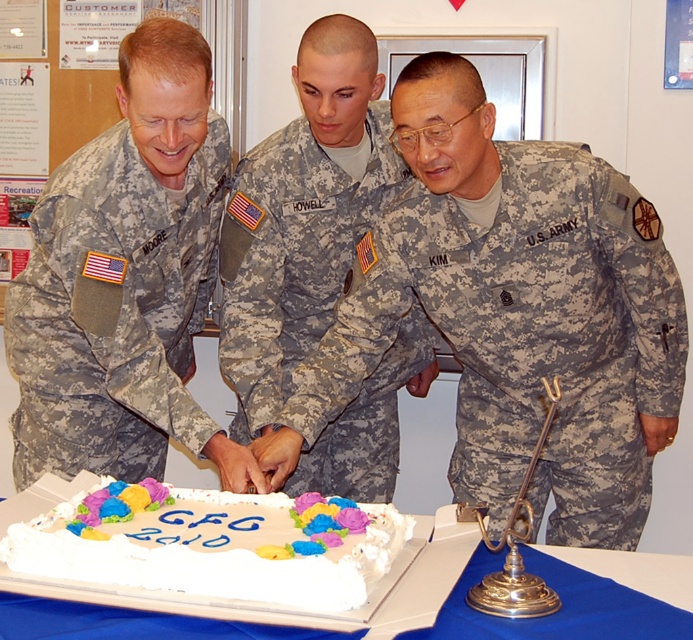
Does camouflage fabric us army uniform at center have a smaller size compared to camouflage fabric uniform at left?

No.

Is camouflage fabric us army uniform at center further to camera compared to camouflage fabric uniform at left?

Yes, camouflage fabric us army uniform at center is behind camouflage fabric uniform at left.

Is point (538, 264) positioned before point (24, 410)?

Yes, it is.

This screenshot has width=693, height=640. In order to click on camouflage fabric us army uniform at center in this screenshot , I will do `click(526, 337)`.

Can you confirm if camouflage fabric uniform at center is positioned below white cardboard cake at center?

Actually, camouflage fabric uniform at center is above white cardboard cake at center.

Who is more forward, (x=369, y=499) or (x=561, y=621)?

Point (x=561, y=621) is in front.

Is point (306, 484) more distant than point (638, 612)?

That is True.

Image resolution: width=693 pixels, height=640 pixels. What are the coordinates of `camouflage fabric uniform at center` in the screenshot? It's located at (292, 256).

In the scene shown: Does camouflage fabric uniform at left appear on the left side of white cardboard cake at center?

Yes, camouflage fabric uniform at left is to the left of white cardboard cake at center.

Which is behind, point (52, 454) or point (622, 612)?

The point (52, 454) is behind.

I want to click on camouflage fabric uniform at left, so click(x=114, y=310).